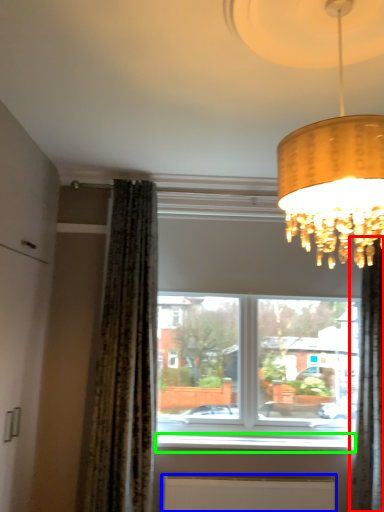
Question: Estimate the real-world distances between objects in this image. Which object is farther from curtain (highlighted by a red box), radiator (highlighted by a blue box) or window sill (highlighted by a green box)?

Choices:
 (A) radiator
 (B) window sill

Answer: (A)